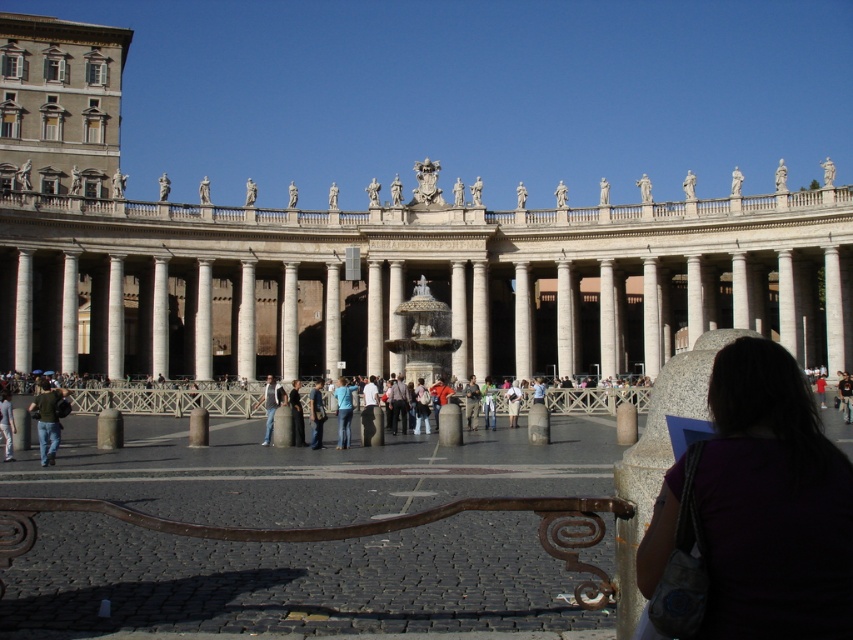
You are a tour guide leading a group to the white marble palace at center. A tourist asks if the dark blue dress at center is wider than the palace. What do you tell them?

The white marble palace at center is wider than the dark blue dress at center, so the dress is not wider than the palace.

You are standing in the center of the colonnade looking towards the paved area with cobblestone patterns. Where is the purple fabric at lower right located relative to your position?

The purple fabric at lower right is located at the lower right position relative to your viewpoint.

You are standing in the foreground of the image, near the cobblestone area with the ornate metal railing. You want to walk directly to the white marble palace at center. Which direction should you move in?

You should move forward towards the white marble palace at center since it is located at the center of the image, directly ahead of your current position near the foreground.